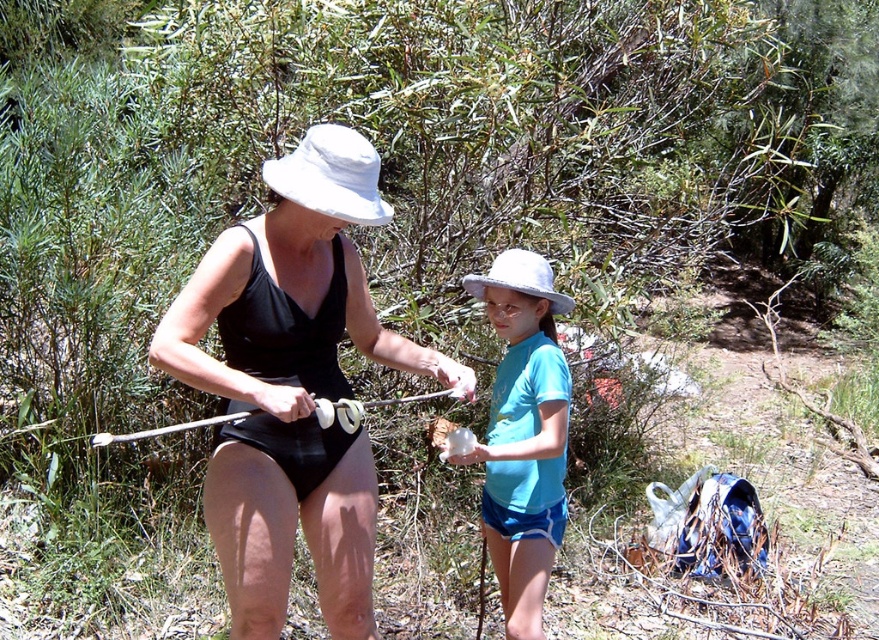
Does point (331, 132) come behind point (535, 269)?

No, it is in front of (535, 269).

Can you confirm if white fabric hat at upper center is positioned to the right of white matte hat at center?

Incorrect, white fabric hat at upper center is not on the right side of white matte hat at center.

This screenshot has width=879, height=640. What do you see at coordinates (331, 176) in the screenshot? I see `white fabric hat at upper center` at bounding box center [331, 176].

Where is `white fabric hat at upper center`? This screenshot has height=640, width=879. white fabric hat at upper center is located at coordinates (331, 176).

Is blue cotton shirt at center positioned behind white fabric hat at upper center?

Yes, it is.

Does point (518, 573) come in front of point (285, 177)?

No, it is not.

The image size is (879, 640). In order to click on blue cotton shirt at center in this screenshot , I will do `click(522, 435)`.

Where is `blue cotton shirt at center`? blue cotton shirt at center is located at coordinates point(522,435).

Who is taller, black matte swimsuit at center or blue cotton shirt at center?

Standing taller between the two is black matte swimsuit at center.

Does point (345, 300) come in front of point (558, 532)?

Yes, point (345, 300) is closer to viewer.

Locate an element on the screen. black matte swimsuit at center is located at coordinates (293, 385).

The height and width of the screenshot is (640, 879). What are the coordinates of `black matte swimsuit at center` in the screenshot? It's located at (293, 385).